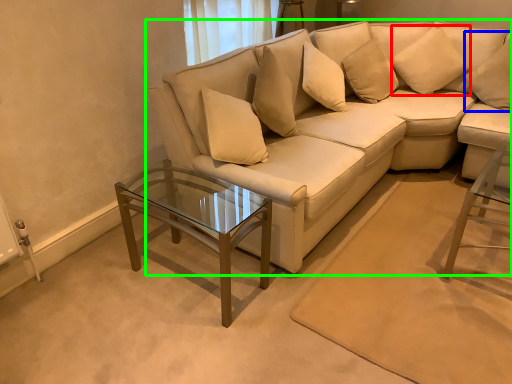
Question: Considering the real-world distances, which object is farthest from pillow (highlighted by a red box)? pillow (highlighted by a blue box) or studio couch (highlighted by a green box)?

Choices:
 (A) pillow
 (B) studio couch

Answer: (B)